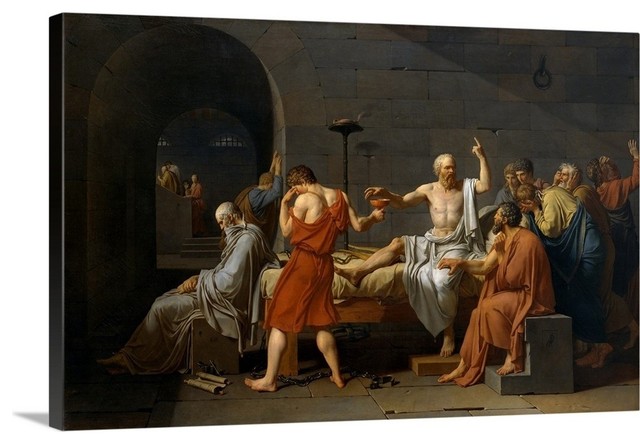
Locate an element on the screen. wall is located at coordinates (450, 118).